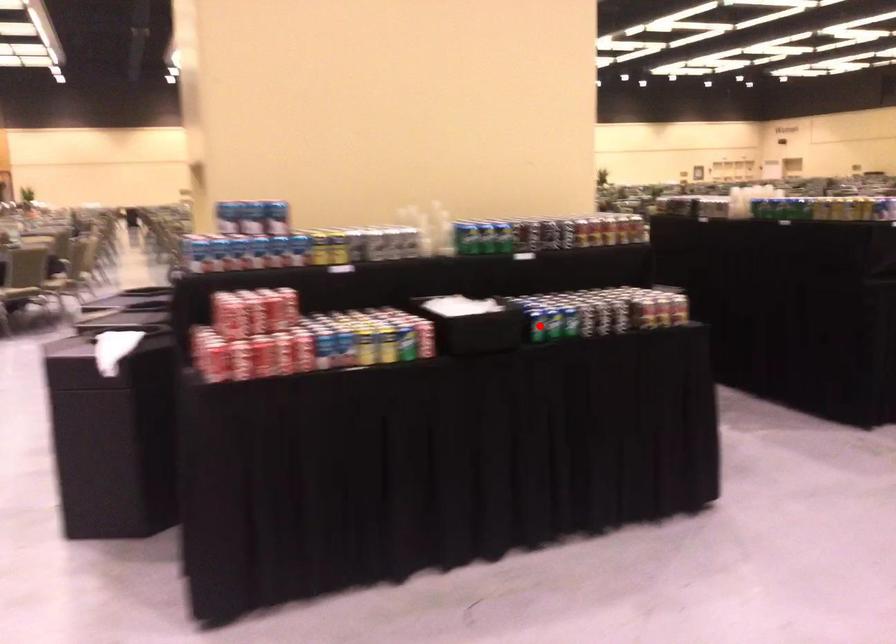
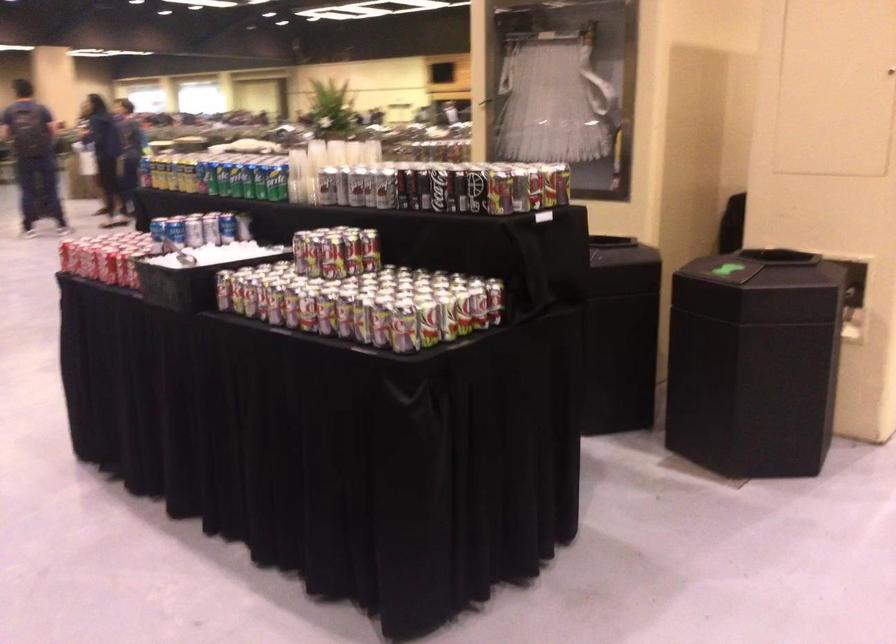
Question: I am providing you with two images of the same scene from different viewpoints. A red point is marked on the first image. Is the red point's position out of view in image 2?

Choices:
 (A) Yes
 (B) No

Answer: (A)